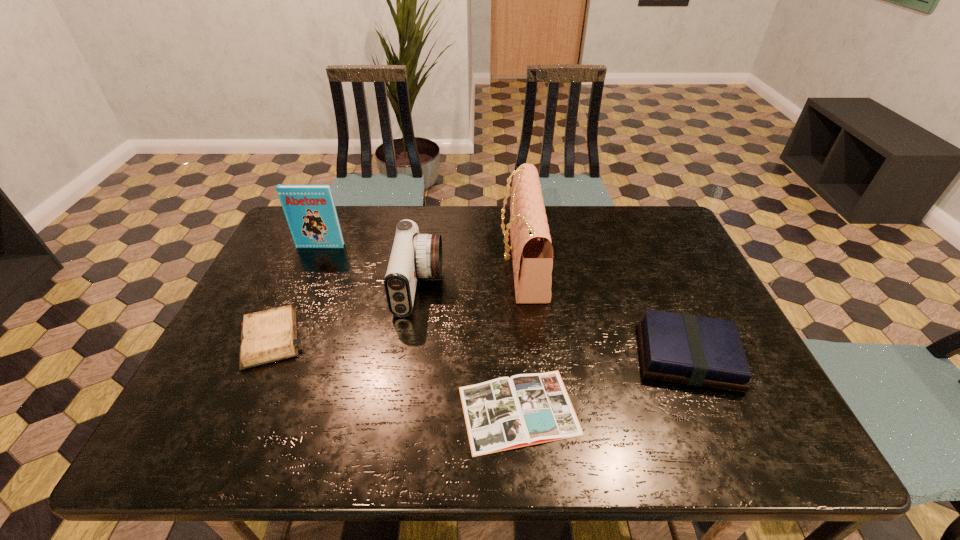
Identify which book is the second closest to the leftmost book. Please provide its 2D coordinates. Your answer should be formatted as a tuple, i.e. [(x, y)], where the tuple contains the x and y coordinates of a point satisfying the conditions above.

[(699, 351)]

Select which book appears as the closest to the leftmost book. Please provide its 2D coordinates. Your answer should be formatted as a tuple, i.e. [(x, y)], where the tuple contains the x and y coordinates of a point satisfying the conditions above.

[(505, 413)]

Find the location of a particular element. This screenshot has height=540, width=960. free space that satisfies the following two spatial constraints: 1. on the surface of the camcorder; 2. on the right side of the rightmost object is located at coordinates (408, 356).

The width and height of the screenshot is (960, 540). Find the location of `vacant region that satisfies the following two spatial constraints: 1. on the front-facing side of the handbag; 2. on the front side of the shortest book`. vacant region that satisfies the following two spatial constraints: 1. on the front-facing side of the handbag; 2. on the front side of the shortest book is located at coordinates (539, 410).

Identify the location of vacant point that satisfies the following two spatial constraints: 1. on the front cover of the tallest book; 2. on the right side of the rightmost object. The image size is (960, 540). (273, 356).

At what (x,y) coordinates should I click in order to perform the action: click on free space that satisfies the following two spatial constraints: 1. on the back side of the shortest book; 2. on the left side of the second shortest book. Please return your answer as a coordinate pair (x, y). This screenshot has width=960, height=540. Looking at the image, I should click on (515, 356).

Image resolution: width=960 pixels, height=540 pixels. In order to click on free spot that satisfies the following two spatial constraints: 1. on the surface of the camcorder; 2. on the right side of the rightmost object in this screenshot , I will do `click(408, 356)`.